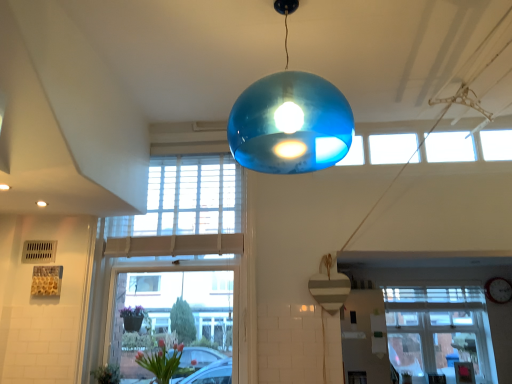
Question: Does point [243, 221] appear closer or farther from the camera than point [177, 354]?

Choices:
 (A) farther
 (B) closer

Answer: (A)

Question: From the image's perspective, is clear glass window at center, which is the 1th window from left to right, located above or below pink glass vase at lower left?

Choices:
 (A) below
 (B) above

Answer: (B)

Question: Which of these objects is positioned farthest from the wooden heart at center?

Choices:
 (A) matte white clock at center
 (B) white matte exhaust hood at upper left
 (C) transparent glass window at lower right, the second window viewed from the top
 (D) pink glass vase at lower left
 (E) clear glass window at center, which is the 1th window from left to right

Answer: (A)

Question: Which object is positioned closest to the matte white clock at center?

Choices:
 (A) transparent glass window at lower right, the second window viewed from the top
 (B) pink glass vase at lower left
 (C) clear glass window at center, which is the 1th window from left to right
 (D) white matte exhaust hood at upper left
 (E) wooden heart at center

Answer: (A)